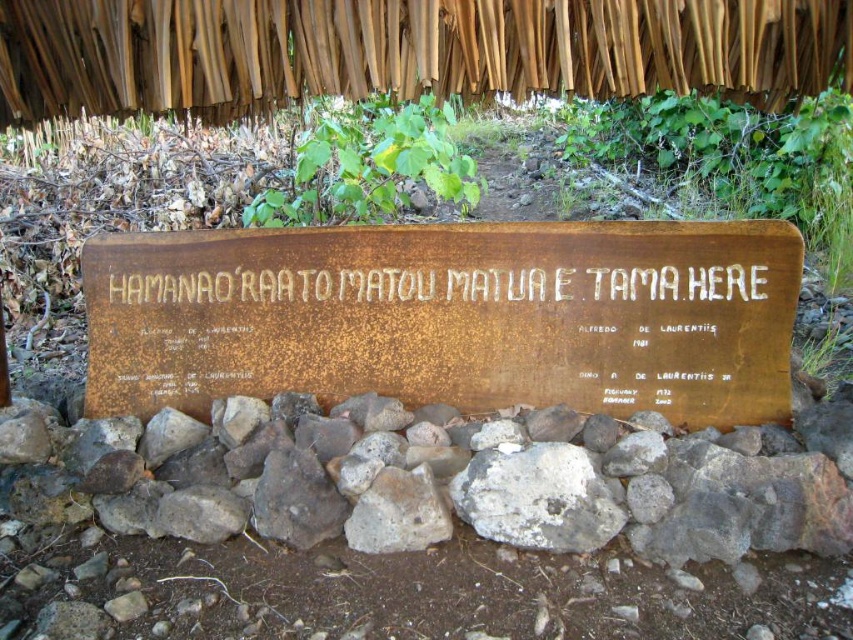
You are a hiker who spots two signs while walking on a trail. You see the rusty wood sign at center and the rusty metal sign at center. Which one is positioned higher up?

The rusty wood sign at center is located above the rusty metal sign at center, so it is positioned higher up.

What is located at the coordinates point (436, 481) in the image?

Result: The rusty metal sign at center is located at point (436, 481).

You are holding a camera that has a maximum focus distance of 10 feet. You want to take a photo of the rusty wood sign at center from where you are standing. Can you capture the sign clearly?

The rusty wood sign at center and camera are 9.44 feet apart, which is within the camera maximum focus distance of 10 feet. Therefore, you can capture the sign clearly.